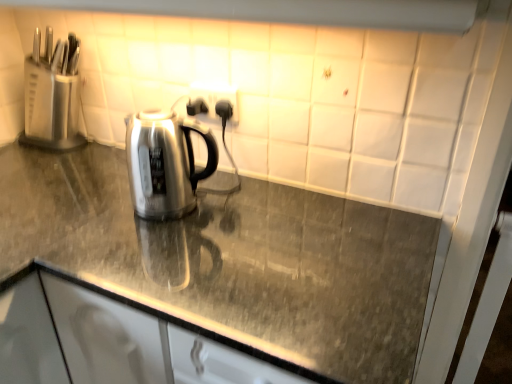
Question: From a real-world perspective, is black plastic outlet at center above or below polished granite countertop at center?

Choices:
 (A) below
 (B) above

Answer: (B)

Question: From the image's perspective, is black plastic outlet at center positioned above or below polished granite countertop at center?

Choices:
 (A) below
 (B) above

Answer: (B)

Question: Estimate the real-world distances between objects in this image. Which object is closer to the polished granite countertop at center?

Choices:
 (A) white glossy exhaust hood at upper center
 (B) black plastic outlet at center

Answer: (B)

Question: Estimate the real-world distances between objects in this image. Which object is closer to the white glossy exhaust hood at upper center?

Choices:
 (A) black plastic outlet at center
 (B) polished granite countertop at center

Answer: (A)